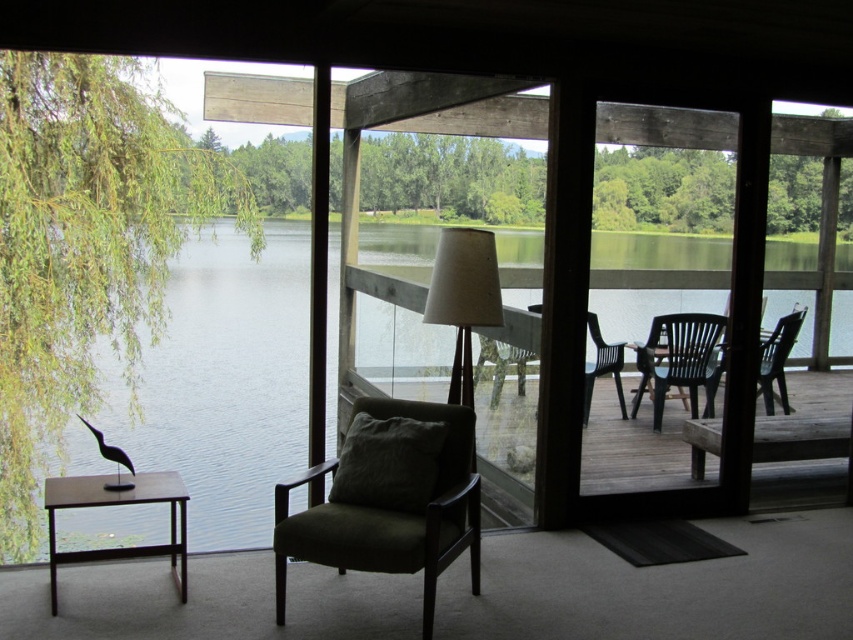
Question: Can you confirm if white fabric lamp at center is positioned above matte black chair at right?

Choices:
 (A) no
 (B) yes

Answer: (B)

Question: Based on their relative distances, which object is farther from the dark green fabric armchair at center?

Choices:
 (A) black plastic armchair at right
 (B) matte black chair at right
 (C) green water at center
 (D) white fabric lamp at center

Answer: (C)

Question: Which point is closer to the camera?

Choices:
 (A) dark green fabric armchair at center
 (B) matte brown table at left

Answer: (A)

Question: Is white fabric lamp at center closer to camera compared to black plastic armchair at right?

Choices:
 (A) yes
 (B) no

Answer: (A)

Question: Is dark green fabric armchair at center wider than white fabric lamp at center?

Choices:
 (A) yes
 (B) no

Answer: (A)

Question: Which of the following is the farthest from the observer?

Choices:
 (A) (703, 333)
 (B) (491, 260)
 (C) (509, 433)
 (D) (114, 476)

Answer: (A)